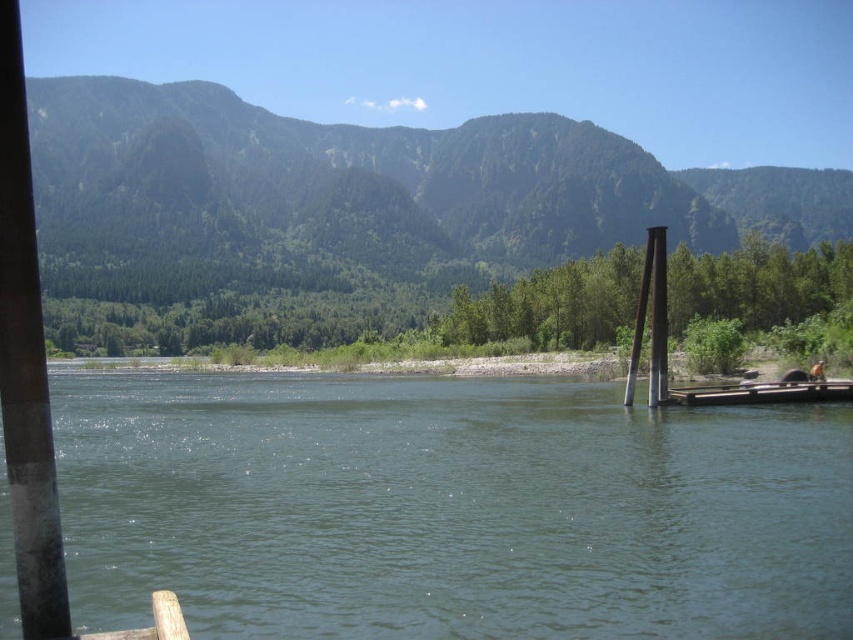
Which of these two, green forested mountain at upper center or brown wooden dock at right, stands taller?

green forested mountain at upper center is taller.

Between green forested mountain at upper center and brown wooden dock at right, which one is positioned higher?

Positioned higher is green forested mountain at upper center.

Between point (316, 216) and point (842, 380), which one is positioned behind?

The point (316, 216) is behind.

You are a GUI agent. You are given a task and a screenshot of the screen. Output one action in this format:
    pyautogui.click(x=<x>, y=<y>)
    Task: Click on the green forested mountain at upper center
    Image resolution: width=853 pixels, height=640 pixels.
    Given the screenshot: What is the action you would take?
    pyautogui.click(x=395, y=227)

Can you confirm if smooth gray pole at left is positioned above brown wooden dock at right?

Yes, smooth gray pole at left is above brown wooden dock at right.

Is point (4, 308) farther from viewer compared to point (851, 384)?

No, it is not.

Who is more forward, (44, 381) or (781, 392)?

Point (44, 381)

Find the location of `smooth gray pole at left`. smooth gray pole at left is located at coordinates (25, 364).

Does greenish-blue water at center come in front of green forested mountain at upper center?

Yes, greenish-blue water at center is closer to the viewer.

Does greenish-blue water at center have a lesser height compared to green forested mountain at upper center?

Correct, greenish-blue water at center is not as tall as green forested mountain at upper center.

Which is in front, point (438, 429) or point (409, 252)?

Positioned in front is point (438, 429).

Locate an element on the screen. This screenshot has width=853, height=640. greenish-blue water at center is located at coordinates [x=450, y=509].